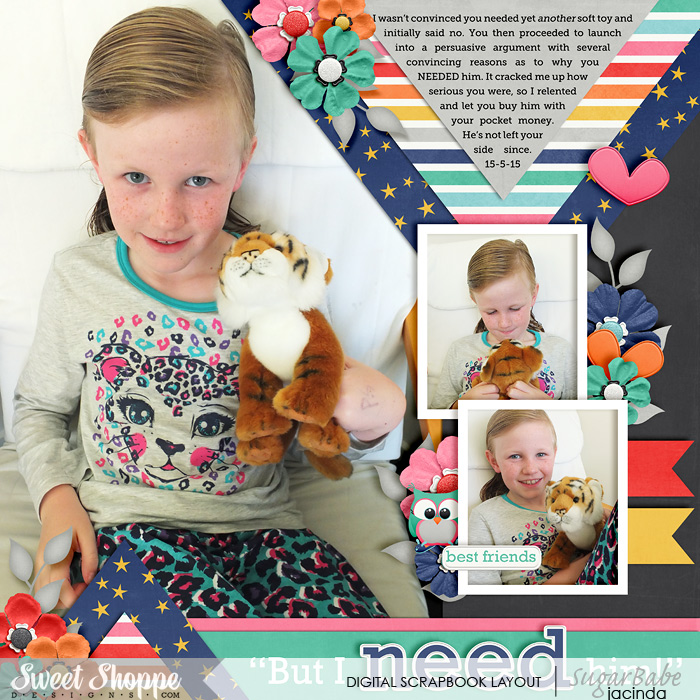
At what (x,y) coordinates should I click in order to perform the action: click on pictures. Please return your answer as a coordinate pair (x, y). The width and height of the screenshot is (700, 700). Looking at the image, I should click on click(504, 524).